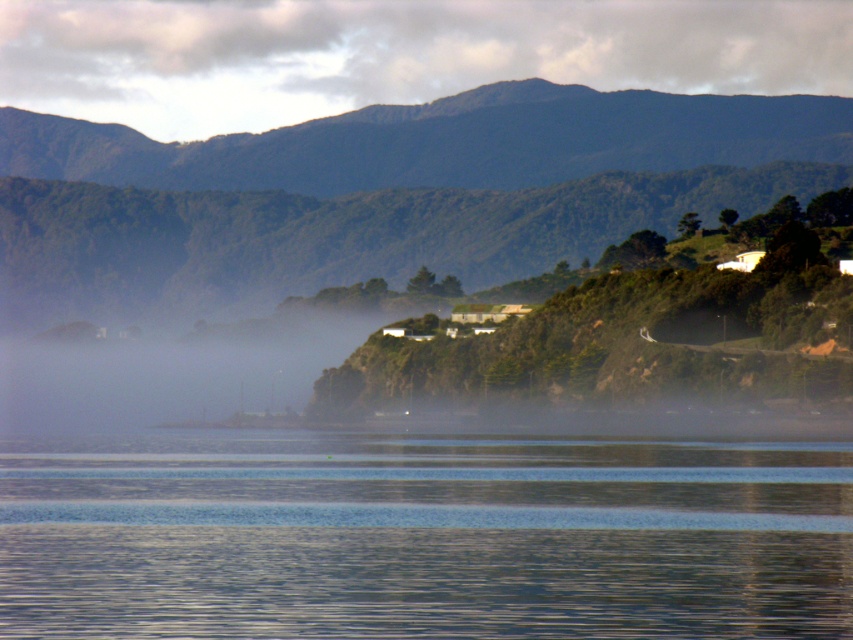
You are a landscape architect designing a new park. You want to ensure that the transparent glass water at center and the dark green textured mountain at upper center are visible from the main viewing area. Based on their sizes, which object will occupy more space in the viewer s field of vision?

The transparent glass water at center will occupy more space in the viewer s field of vision because it is larger in size than the dark green textured mountain at upper center.

You are a photographer planning to capture the transparent glass water at center and the green forested mountain at upper center in a single frame. Based on the scene, which object occupies a smaller portion of the image horizontally?

The transparent glass water at center has a lesser width compared to the green forested mountain at upper center, so it occupies a smaller portion horizontally in the image.